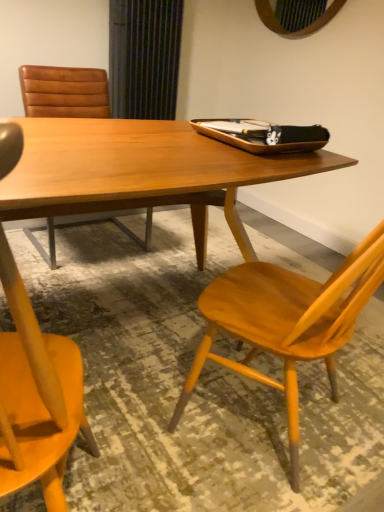
This screenshot has width=384, height=512. Find the location of `free space between wooden table at center and wooden chair at right, which is the 1th chair from front to back`. free space between wooden table at center and wooden chair at right, which is the 1th chair from front to back is located at coordinates (203, 470).